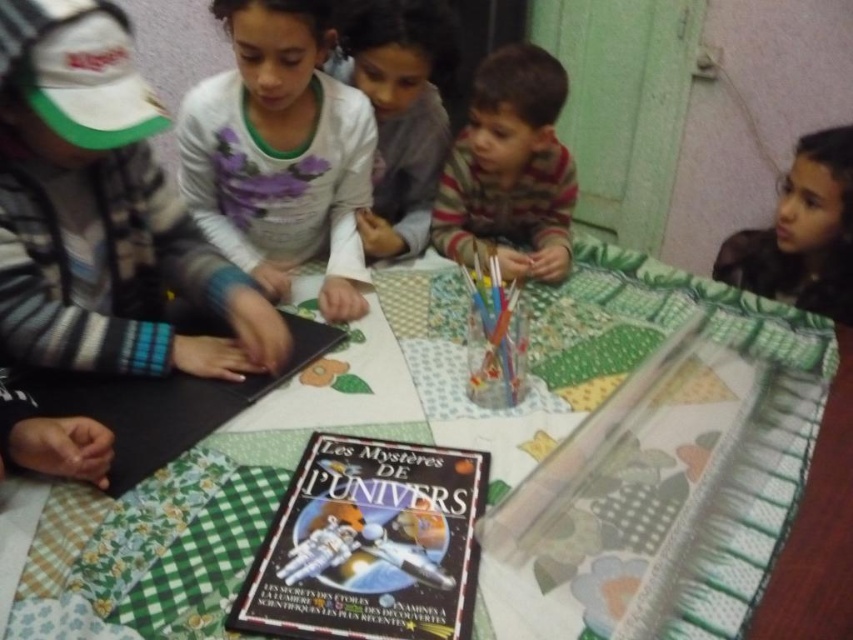
Who is higher up, striped cotton shirt at center or matte white shirt at upper center?

Positioned higher is matte white shirt at upper center.

How far apart are striped cotton shirt at center and matte white shirt at upper center?

striped cotton shirt at center is 5.73 inches from matte white shirt at upper center.

Find the location of a particular element. Image resolution: width=853 pixels, height=640 pixels. striped cotton shirt at center is located at coordinates (509, 170).

You are a GUI agent. You are given a task and a screenshot of the screen. Output one action in this format:
    pyautogui.click(x=<x>, y=<y>)
    Task: Click on the striped cotton shirt at center
    
    Given the screenshot: What is the action you would take?
    pyautogui.click(x=509, y=170)

This screenshot has width=853, height=640. Describe the element at coordinates (398, 112) in the screenshot. I see `matte white shirt at upper center` at that location.

Can you confirm if matte white shirt at upper center is shorter than hardcover book at lower left?

Incorrect, matte white shirt at upper center's height does not fall short of hardcover book at lower left's.

This screenshot has width=853, height=640. Describe the element at coordinates (398, 112) in the screenshot. I see `matte white shirt at upper center` at that location.

Where is `matte white shirt at upper center`? matte white shirt at upper center is located at coordinates (398, 112).

Does green quilted table at center have a larger size compared to hardcover book at center?

Correct, green quilted table at center is larger in size than hardcover book at center.

I want to click on green quilted table at center, so click(x=361, y=435).